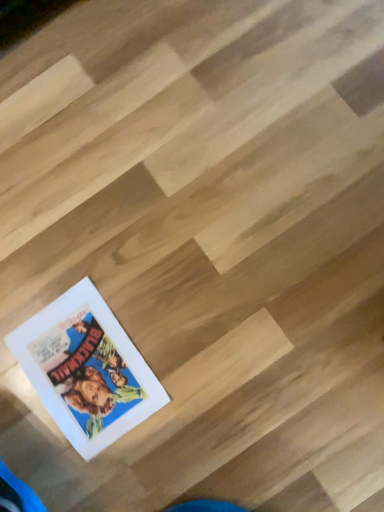
The image size is (384, 512). I want to click on free point below matte paper book at bottom left (from a real-world perspective), so click(87, 372).